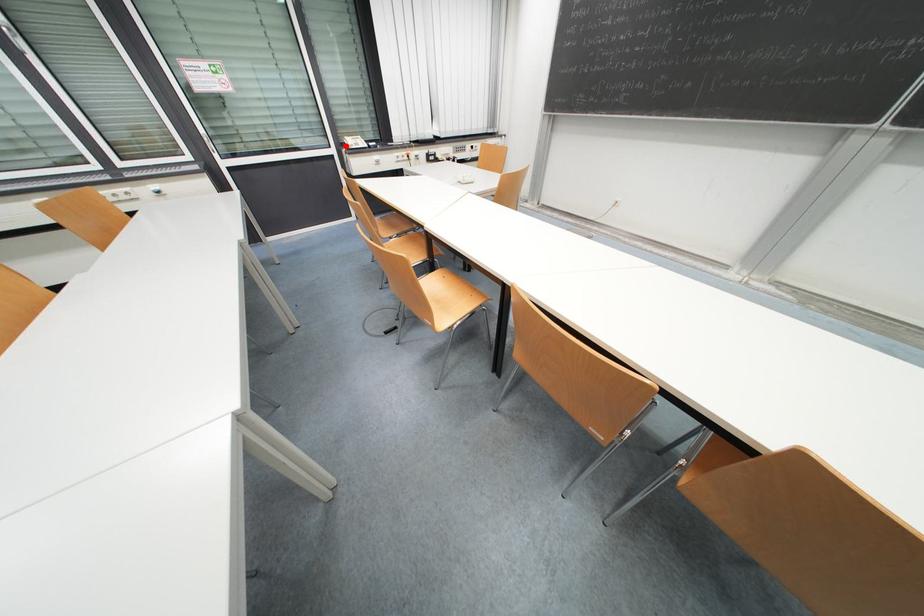
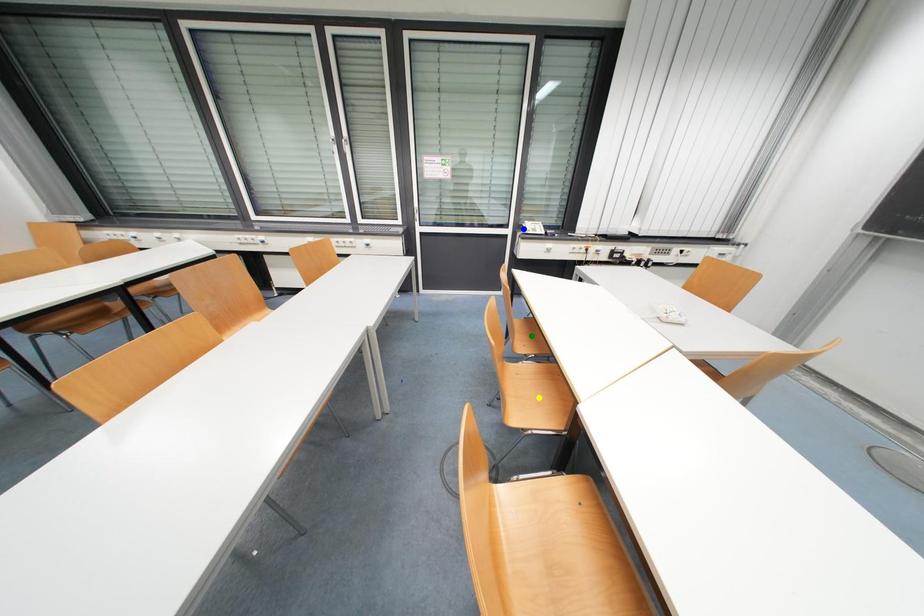
Question: I am providing you with two images of the same scene from different viewpoints. A red point is marked on the first image. You are given multiple points on the second image. Which point in image 2 represents the same 3d spot as the red point in image 1?

Choices:
 (A) green point
 (B) blue point
 (C) yellow point

Answer: (B)